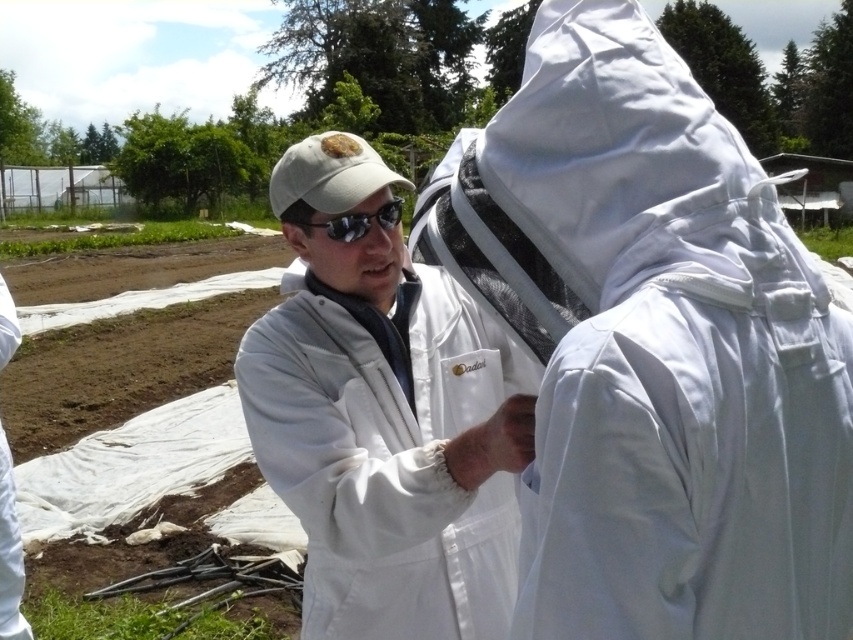
Question: Is white fabric beekeeping suit at center positioned behind white matte lab coat at center?

Choices:
 (A) no
 (B) yes

Answer: (A)

Question: Which point is closer to the camera taking this photo?

Choices:
 (A) (624, 195)
 (B) (341, 403)

Answer: (A)

Question: Does white fabric beekeeping suit at center appear over white matte lab coat at center?

Choices:
 (A) no
 (B) yes

Answer: (B)

Question: Considering the relative positions of white fabric beekeeping suit at center and white matte lab coat at center in the image provided, where is white fabric beekeeping suit at center located with respect to white matte lab coat at center?

Choices:
 (A) below
 (B) above

Answer: (B)

Question: Which object appears closest to the camera in this image?

Choices:
 (A) white fabric beekeeping suit at center
 (B) white matte lab coat at center

Answer: (A)

Question: Which point appears closest to the camera in this image?

Choices:
 (A) (535, 570)
 (B) (268, 376)

Answer: (A)